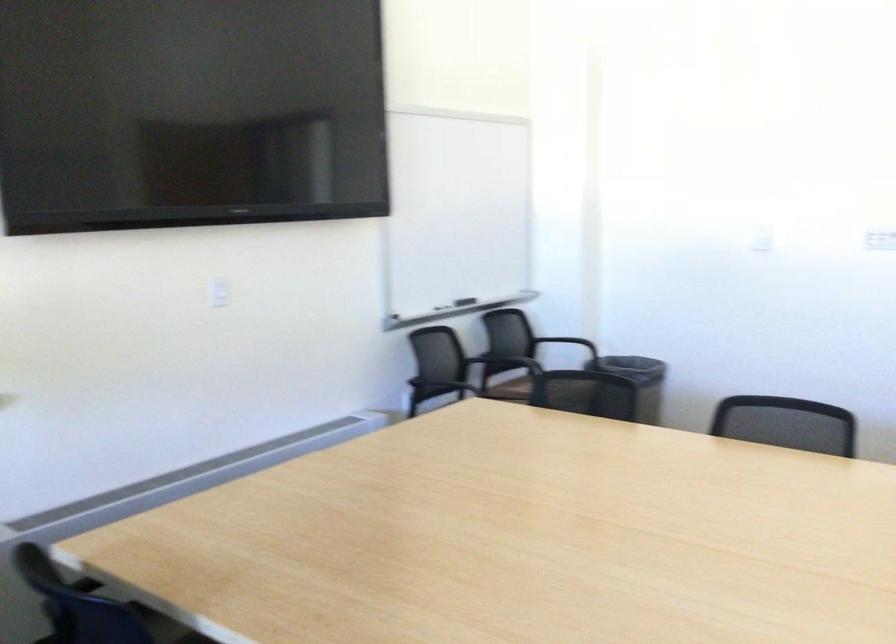
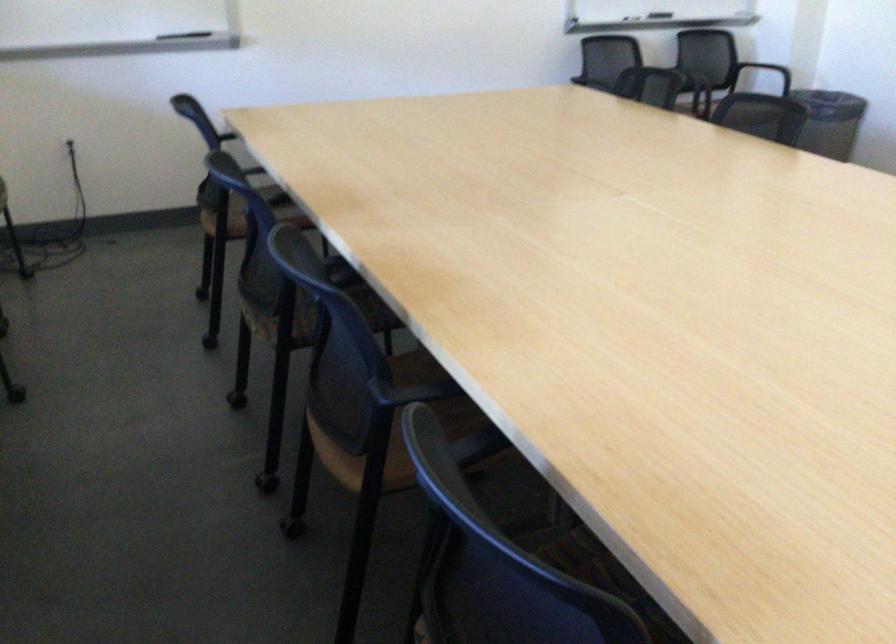
Where in the second image is the point corresponding to point (419, 353) from the first image?

(607, 57)